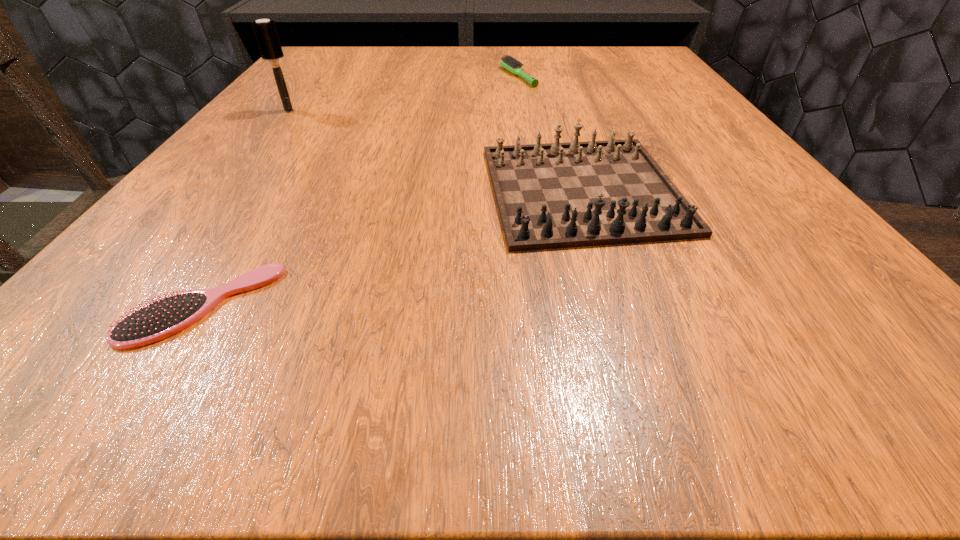
Identify the location of free region at the near left corner of the desktop. This screenshot has height=540, width=960. [40, 375].

What are the coordinates of `vacant space at the far right corner of the desktop` in the screenshot? It's located at (642, 70).

Find the location of `vacant area between the shortest hairbrush and the second nearest object`. vacant area between the shortest hairbrush and the second nearest object is located at coordinates (393, 247).

Find the location of a particular element. free space between the nearest object and the third shortest object is located at coordinates (393, 247).

Find the location of a particular element. This screenshot has width=960, height=540. empty location between the nearest hairbrush and the tallest hairbrush is located at coordinates (245, 208).

The image size is (960, 540). What are the coordinates of `empty space between the rightmost hairbrush and the shortest hairbrush` in the screenshot? It's located at (360, 191).

Find the location of a particular element. free area in between the second tallest object and the farthest hairbrush is located at coordinates (550, 133).

Where is `blank region between the second nearest object and the farthest hairbrush`? This screenshot has height=540, width=960. blank region between the second nearest object and the farthest hairbrush is located at coordinates (550, 133).

The image size is (960, 540). What are the coordinates of `free space between the second tallest object and the second nearest hairbrush` in the screenshot? It's located at (436, 150).

This screenshot has height=540, width=960. Identify the location of vacant area that lies between the rightmost hairbrush and the chessboard. (550, 133).